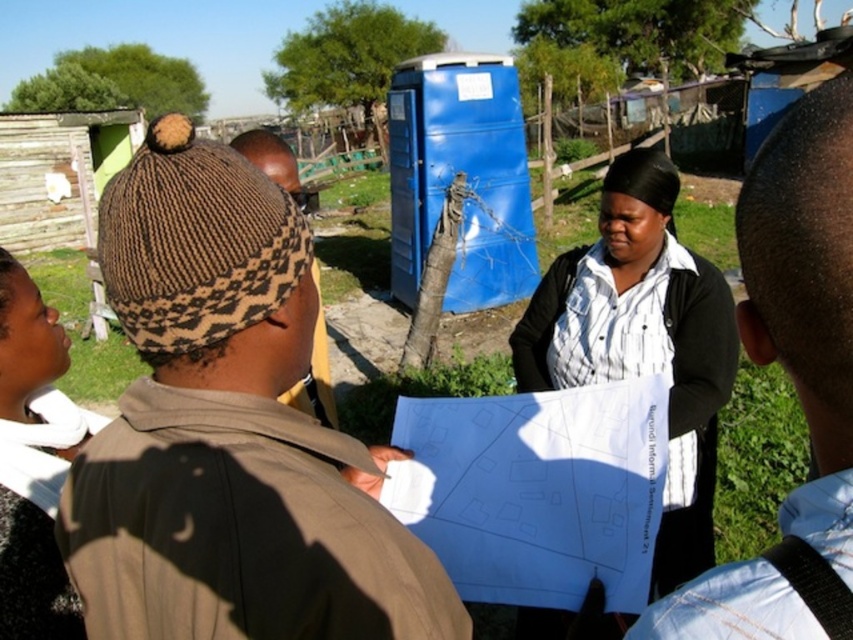
You are standing in the outdoor scene and want to determine which person is shorter between the brown knitted hat at upper left and the light blue shirt at upper right. Can you figure it out?

The brown knitted hat at upper left is not as tall as the light blue shirt at upper right, so the person with the brown knitted hat at upper left is shorter.